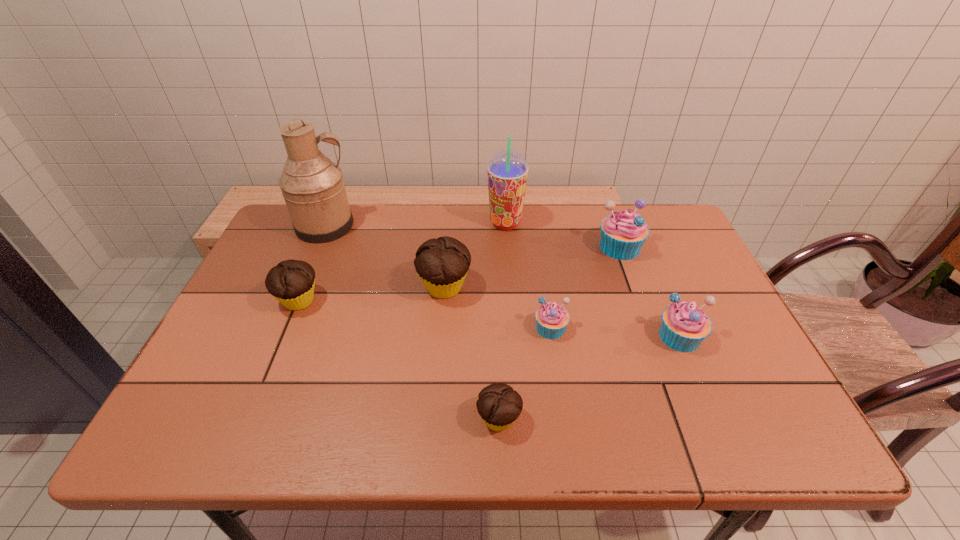
At what (x,y) coordinates should I click in order to perform the action: click on vacant space at the near edge. Please return your answer as a coordinate pair (x, y). The height and width of the screenshot is (540, 960). Looking at the image, I should click on (576, 437).

Find the location of a particular element. vacant space at the near left corner of the desktop is located at coordinates (197, 433).

Where is `empty space that is in between the third object from left to right and the leftmost muffin`? The height and width of the screenshot is (540, 960). empty space that is in between the third object from left to right and the leftmost muffin is located at coordinates (372, 294).

At what (x,y) coordinates should I click in order to perform the action: click on vacant area between the third muffin from right to left and the seventh shortest object. Please return your answer as a coordinate pair (x, y). This screenshot has width=960, height=540. Looking at the image, I should click on (528, 275).

In order to click on vacant space that is in between the leftmost blue muffin and the smoothie in this screenshot , I will do `click(528, 275)`.

I want to click on vacant space that's between the second smallest blue muffin and the nearest muffin, so click(x=589, y=378).

At what (x,y) coordinates should I click in order to perform the action: click on free point between the leftmost blue muffin and the smoothie. Please return your answer as a coordinate pair (x, y). The width and height of the screenshot is (960, 540). Looking at the image, I should click on (528, 275).

Where is `vacant point located between the rightmost chocolate muffin and the fourth muffin from left to right`? vacant point located between the rightmost chocolate muffin and the fourth muffin from left to right is located at coordinates (525, 374).

The width and height of the screenshot is (960, 540). I want to click on empty location between the second chocolate muffin from left to right and the leftmost blue muffin, so click(x=497, y=308).

This screenshot has width=960, height=540. I want to click on vacant point located between the smoothie and the leftmost blue muffin, so click(528, 275).